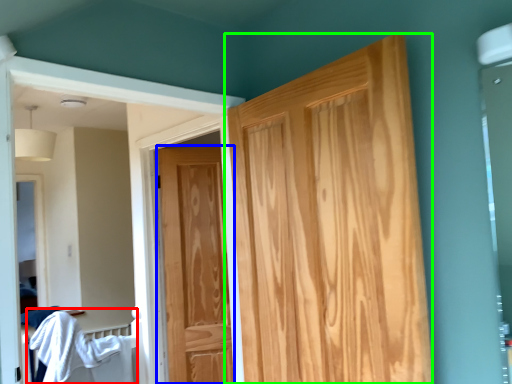
Question: Based on their relative distances, which object is farther from bed (highlighted by a red box)? Choose from door (highlighted by a blue box) and door (highlighted by a green box).

Choices:
 (A) door
 (B) door

Answer: (B)